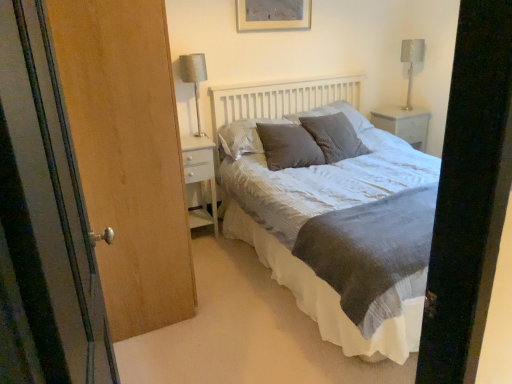
The height and width of the screenshot is (384, 512). I want to click on white wood nightstand at left, arranged as the first nightstand when viewed from the left, so pyautogui.click(x=200, y=178).

What do you see at coordinates (336, 217) in the screenshot? I see `textured gray bed at center` at bounding box center [336, 217].

I want to click on matte gray picture frame at upper center, so click(273, 15).

Describe the element at coordinates (244, 136) in the screenshot. Image resolution: width=512 pixels, height=384 pixels. I see `textured gray pillow at center, the 3th pillow when ordered from right to left` at that location.

The width and height of the screenshot is (512, 384). I want to click on textured gray pillow at center, the 3th pillow when ordered from right to left, so click(x=244, y=136).

Locate an element on the screen. silver metallic table lamp at left, arranged as the second table lamp when viewed from the back is located at coordinates (194, 78).

This screenshot has width=512, height=384. What do you see at coordinates (288, 146) in the screenshot?
I see `gray textured pillow at center, acting as the 2th pillow starting from the right` at bounding box center [288, 146].

What is the approximate width of white wood nightstand at right, arranged as the second nightstand when viewed from the left?

white wood nightstand at right, arranged as the second nightstand when viewed from the left, is 17.00 inches wide.

What do you see at coordinates (404, 124) in the screenshot?
I see `white wood nightstand at right, placed as the first nightstand when sorted from right to left` at bounding box center [404, 124].

Find the location of a particular element. The image size is (512, 384). white wood nightstand at left, arranged as the first nightstand when viewed from the left is located at coordinates (200, 178).

Consider the image. Does matte gray picture frame at upper center contain white wood nightstand at left, the first nightstand ordered from the bottom?

No, white wood nightstand at left, the first nightstand ordered from the bottom, is not a part of matte gray picture frame at upper center.

Can you tell me how much matte gray picture frame at upper center and white wood nightstand at left, the second nightstand viewed from the back, differ in facing direction?

0.303 degrees.

From the image's perspective, is matte gray picture frame at upper center beneath white wood nightstand at left, placed as the 1th nightstand when sorted from front to back?

No.

Is matte gray picture frame at upper center turned away from white wood nightstand at left, the second nightstand viewed from the back?

No, matte gray picture frame at upper center's orientation is not away from white wood nightstand at left, the second nightstand viewed from the back.

Is textured gray pillow at center, the 1th pillow in the right-to-left sequence, inside or outside of gray textured pillow at center, acting as the 2th pillow starting from the right?

textured gray pillow at center, the 1th pillow in the right-to-left sequence, is spatially situated outside gray textured pillow at center, acting as the 2th pillow starting from the right.

Considering the sizes of textured gray pillow at center, the 1th pillow in the right-to-left sequence, and gray textured pillow at center, acting as the 2th pillow starting from the right, in the image, is textured gray pillow at center, the 1th pillow in the right-to-left sequence, taller or shorter than gray textured pillow at center, acting as the 2th pillow starting from the right,?

Considering their sizes, textured gray pillow at center, the 1th pillow in the right-to-left sequence, has more height than gray textured pillow at center, acting as the 2th pillow starting from the right.

Based on the photo, would you say textured gray pillow at center, the 1th pillow in the right-to-left sequence, is to the left or to the right of gray textured pillow at center, which is the 2th pillow in left-to-right order, in the picture?

From the image, it's evident that textured gray pillow at center, the 1th pillow in the right-to-left sequence, is to the right of gray textured pillow at center, which is the 2th pillow in left-to-right order.

Can you tell me how much textured gray pillow at center, the third pillow in the left-to-right sequence, and gray textured pillow at center, acting as the 2th pillow starting from the right, differ in facing direction?

19.7 degrees.

Is point (184, 144) closer to camera compared to point (180, 70)?

No.

Is white wood nightstand at left, marked as the second nightstand in a right-to-left arrangement, positioned beyond the bounds of silver metallic table lamp at left, which is the 2th table lamp in right-to-left order?

white wood nightstand at left, marked as the second nightstand in a right-to-left arrangement, lies outside silver metallic table lamp at left, which is the 2th table lamp in right-to-left order,'s area.

Is white wood nightstand at left, which appears as the 2th nightstand when viewed from the top, in front of or behind silver metallic table lamp at left, arranged as the first table lamp when viewed from the left, in the image?

Visually, white wood nightstand at left, which appears as the 2th nightstand when viewed from the top, is located behind silver metallic table lamp at left, arranged as the first table lamp when viewed from the left.

Can we say wooden screen door at left lies outside textured gray pillow at center, the third pillow in the left-to-right sequence?

wooden screen door at left is positioned outside textured gray pillow at center, the third pillow in the left-to-right sequence.

Between wooden screen door at left and textured gray pillow at center, the third pillow in the left-to-right sequence, which one has larger width?

With larger width is textured gray pillow at center, the third pillow in the left-to-right sequence.

Is wooden screen door at left looking in the opposite direction of textured gray pillow at center, the 1th pillow in the right-to-left sequence?

wooden screen door at left does not have its back to textured gray pillow at center, the 1th pillow in the right-to-left sequence.

The width and height of the screenshot is (512, 384). In order to click on screen door in front of the textured gray pillow at center, the third pillow in the left-to-right sequence in this screenshot , I will do `click(46, 210)`.

Consider the image. Is the position of white wood nightstand at right, arranged as the second nightstand when viewed from the left, more distant than that of wooden screen door at left?

Yes, it is.

Looking at this image, how different are the orientations of white wood nightstand at right, placed as the first nightstand when sorted from right to left, and wooden screen door at left in degrees?

The angle between the facing direction of white wood nightstand at right, placed as the first nightstand when sorted from right to left, and the facing direction of wooden screen door at left is 84.5 degrees.

In the scene shown: How much distance is there between white wood nightstand at right, arranged as the second nightstand when viewed from the left, and wooden screen door at left?

10.70 feet.

Which is closer, (383,117) or (33,45)?

The point (33,45) is closer.

Is metallic silver table lamp at upper right, acting as the second table lamp starting from the left, situated inside silver metallic table lamp at left, which appears as the first table lamp when viewed from the front, or outside?

metallic silver table lamp at upper right, acting as the second table lamp starting from the left, is not enclosed by silver metallic table lamp at left, which appears as the first table lamp when viewed from the front.

From the image's perspective, relative to silver metallic table lamp at left, arranged as the first table lamp when viewed from the left, is metallic silver table lamp at upper right, the 1th table lamp when ordered from back to front, above or below?

metallic silver table lamp at upper right, the 1th table lamp when ordered from back to front, is situated higher than silver metallic table lamp at left, arranged as the first table lamp when viewed from the left, in the image.

From the picture: Is metallic silver table lamp at upper right, acting as the second table lamp starting from the left, bigger than silver metallic table lamp at left, arranged as the first table lamp when viewed from the left?

Incorrect, metallic silver table lamp at upper right, acting as the second table lamp starting from the left, is not larger than silver metallic table lamp at left, arranged as the first table lamp when viewed from the left.

Does metallic silver table lamp at upper right, placed as the 2th table lamp when sorted from front to back, have a lesser width compared to silver metallic table lamp at left, which is the 2th table lamp in right-to-left order?

Indeed, metallic silver table lamp at upper right, placed as the 2th table lamp when sorted from front to back, has a lesser width compared to silver metallic table lamp at left, which is the 2th table lamp in right-to-left order.

Does point (257, 24) come farther from viewer compared to point (354, 150)?

No, it is in front of (354, 150).

Between matte gray picture frame at upper center and textured gray pillow at center, the third pillow in the left-to-right sequence, which one has more height?

With more height is textured gray pillow at center, the third pillow in the left-to-right sequence.

Is matte gray picture frame at upper center facing towards textured gray pillow at center, the third pillow in the left-to-right sequence?

→ No, matte gray picture frame at upper center is not facing towards textured gray pillow at center, the third pillow in the left-to-right sequence.

How much distance is there between matte gray picture frame at upper center and textured gray pillow at center, the 1th pillow in the right-to-left sequence?

matte gray picture frame at upper center is 36.84 inches away from textured gray pillow at center, the 1th pillow in the right-to-left sequence.

Identify the location of the 2nd nightstand positioned below the matte gray picture frame at upper center (from a real-world perspective). This screenshot has height=384, width=512. pos(200,178).

Where is `pillow below the textured gray pillow at center, the third pillow in the left-to-right sequence (from the image's perspective)`? pillow below the textured gray pillow at center, the third pillow in the left-to-right sequence (from the image's perspective) is located at coordinates (288, 146).

Estimate the real-world distances between objects in this image. Which object is further from metallic silver table lamp at upper right, the 1th table lamp when ordered from back to front, white wood nightstand at right, which is counted as the second nightstand, starting from the bottom, or white wood nightstand at left, placed as the 1th nightstand when sorted from front to back?

white wood nightstand at left, placed as the 1th nightstand when sorted from front to back, is further to metallic silver table lamp at upper right, the 1th table lamp when ordered from back to front.

Based on their spatial positions, is textured gray pillow at center, the 1th pillow in the right-to-left sequence, or wooden screen door at left closer to white wood nightstand at left, arranged as the first nightstand when viewed from the left?

textured gray pillow at center, the 1th pillow in the right-to-left sequence.

Estimate the real-world distances between objects in this image. Which object is closer to metallic silver table lamp at upper right, positioned as the 1th table lamp in right-to-left order, silver metallic table lamp at left, which is the 2th table lamp in right-to-left order, or textured gray pillow at center, the 1th pillow in the right-to-left sequence?

Based on the image, textured gray pillow at center, the 1th pillow in the right-to-left sequence, appears to be nearer to metallic silver table lamp at upper right, positioned as the 1th table lamp in right-to-left order.

Which object lies nearer to the anchor point gray textured pillow at center, which is the 2th pillow in left-to-right order, silver metallic table lamp at left, arranged as the second table lamp when viewed from the back, or wooden screen door at left?

Among the two, silver metallic table lamp at left, arranged as the second table lamp when viewed from the back, is located nearer to gray textured pillow at center, which is the 2th pillow in left-to-right order.

Considering their positions, is textured gray pillow at center, arranged as the first pillow when viewed from the left, positioned closer to textured gray pillow at center, the 1th pillow in the right-to-left sequence, than white wood nightstand at left, the first nightstand ordered from the bottom?

The object closer to textured gray pillow at center, the 1th pillow in the right-to-left sequence, is textured gray pillow at center, arranged as the first pillow when viewed from the left.

When comparing their distances from textured gray bed at center, does matte gray picture frame at upper center or gray textured pillow at center, which is the 2th pillow in left-to-right order, seem further?

The object further to textured gray bed at center is matte gray picture frame at upper center.

Based on their spatial positions, is metallic silver table lamp at upper right, placed as the 2th table lamp when sorted from front to back, or matte gray picture frame at upper center closer to white wood nightstand at left, the second nightstand viewed from the back?

matte gray picture frame at upper center is positioned closer to the anchor white wood nightstand at left, the second nightstand viewed from the back.

Estimate the real-world distances between objects in this image. Which object is closer to gray textured pillow at center, which is the 2th pillow in left-to-right order, metallic silver table lamp at upper right, the 1th table lamp when ordered from back to front, or white wood nightstand at left, the second nightstand viewed from the back?

The object closer to gray textured pillow at center, which is the 2th pillow in left-to-right order, is white wood nightstand at left, the second nightstand viewed from the back.

Identify the location of picture frame between wooden screen door at left and white wood nightstand at right, which is the second nightstand in front-to-back order, from front to back. (273, 15).

I want to click on table lamp located between textured gray bed at center and matte gray picture frame at upper center in the depth direction, so click(x=194, y=78).

In order to click on pillow located between textured gray bed at center and white wood nightstand at left, the first nightstand ordered from the bottom, in the depth direction in this screenshot , I will do `click(288, 146)`.

You are a GUI agent. You are given a task and a screenshot of the screen. Output one action in this format:
    pyautogui.click(x=<x>, y=<y>)
    Task: Click on the nightstand between textured gray pillow at center, the 3th pillow when ordered from right to left, and metallic silver table lamp at upper right, acting as the second table lamp starting from the left
    
    Given the screenshot: What is the action you would take?
    pyautogui.click(x=404, y=124)